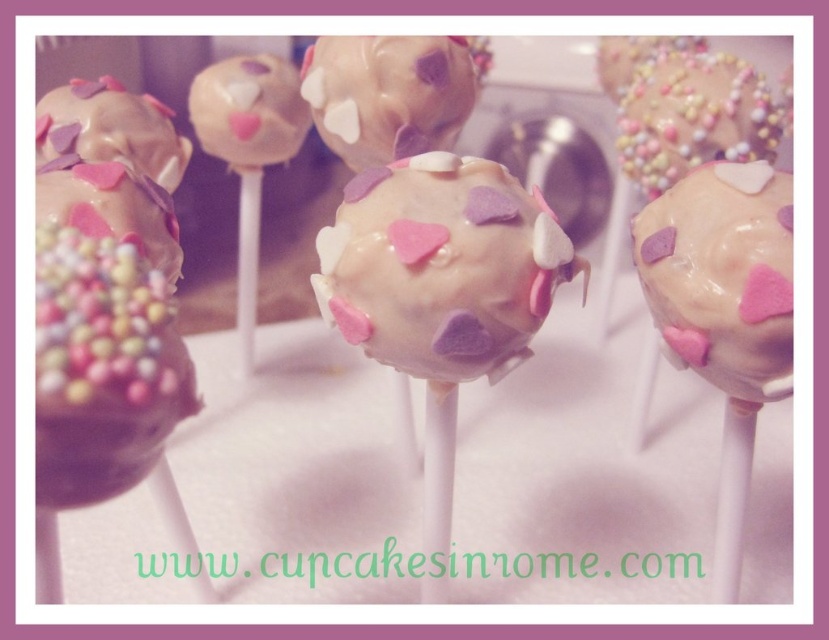
Is white glossy cake pop at center above matte white cake pop at center?

No, white glossy cake pop at center is not above matte white cake pop at center.

The height and width of the screenshot is (640, 829). Describe the element at coordinates (442, 268) in the screenshot. I see `white glossy cake pop at center` at that location.

Image resolution: width=829 pixels, height=640 pixels. In order to click on white glossy cake pop at center in this screenshot , I will do `click(442, 268)`.

Is point (161, 116) positioned in front of point (285, 134)?

Yes, point (161, 116) is closer to viewer.

Can you confirm if matte chocolate cake pop at upper left is wider than matte white cake pop at center?

Yes, matte chocolate cake pop at upper left is wider than matte white cake pop at center.

Is point (46, 122) positioned after point (246, 104)?

No, it is not.

The image size is (829, 640). Find the location of `matte chocolate cake pop at upper left`. matte chocolate cake pop at upper left is located at coordinates (110, 129).

Where is `white glossy cake pop at center`? white glossy cake pop at center is located at coordinates (442, 268).

Looking at this image, who is positioned more to the right, white glossy cake pop at center or pastel sprinkled cake pop at center?

Positioned to the right is pastel sprinkled cake pop at center.

Does point (493, 216) come closer to viewer compared to point (733, 77)?

Yes, it is in front of point (733, 77).

This screenshot has height=640, width=829. Identify the location of white glossy cake pop at center. (442, 268).